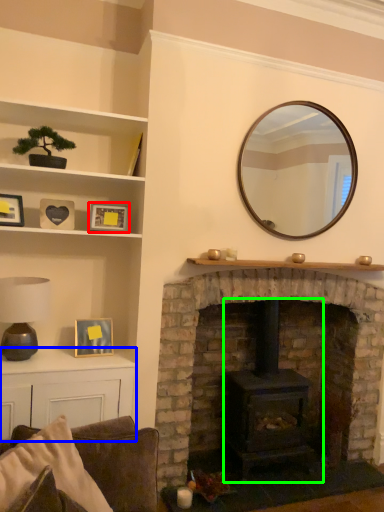
Question: Which is farther away from picture frame (highlighted by a red box)? table (highlighted by a blue box) or wood burning stove (highlighted by a green box)?

Choices:
 (A) table
 (B) wood burning stove

Answer: (B)